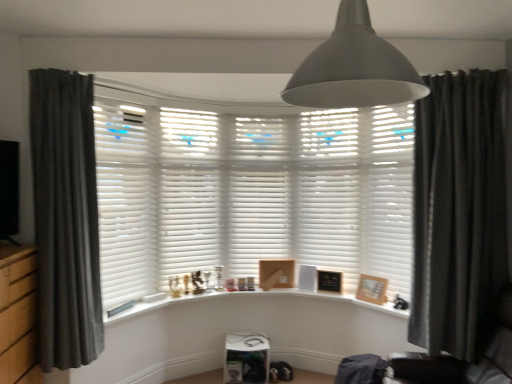
Identify the location of vacant space situated on the left part of wooden picture frame at right, which is counted as the 1th picture frame, starting from the front. This screenshot has height=384, width=512. (356, 297).